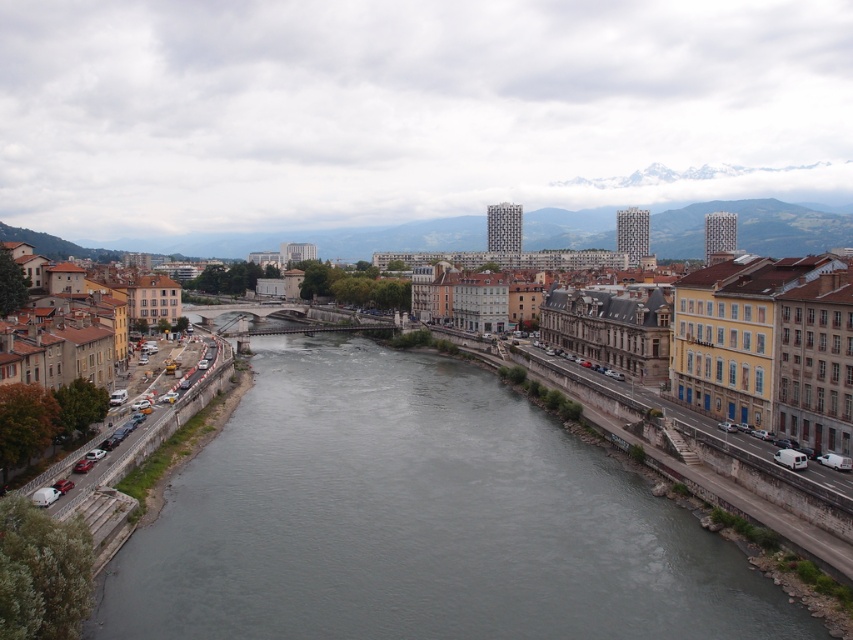
Question: Which point is closer to the camera taking this photo?

Choices:
 (A) (241, 307)
 (B) (840, 237)
 (C) (384, 401)

Answer: (C)

Question: Which point appears farthest from the camera in this image?

Choices:
 (A) (408, 243)
 (B) (299, 321)
 (C) (387, 476)

Answer: (A)

Question: Is smooth concrete bridge at center above concrete bridge at center?

Choices:
 (A) yes
 (B) no

Answer: (A)

Question: Is gray concrete waterway at lower left positioned behind smooth concrete bridge at center?

Choices:
 (A) no
 (B) yes

Answer: (A)

Question: Which object is the closest to the gray concrete waterway at lower left?

Choices:
 (A) smooth concrete bridge at center
 (B) concrete bridge at center

Answer: (B)

Question: Does smooth concrete bridge at center appear on the right side of concrete bridge at center?

Choices:
 (A) no
 (B) yes

Answer: (B)